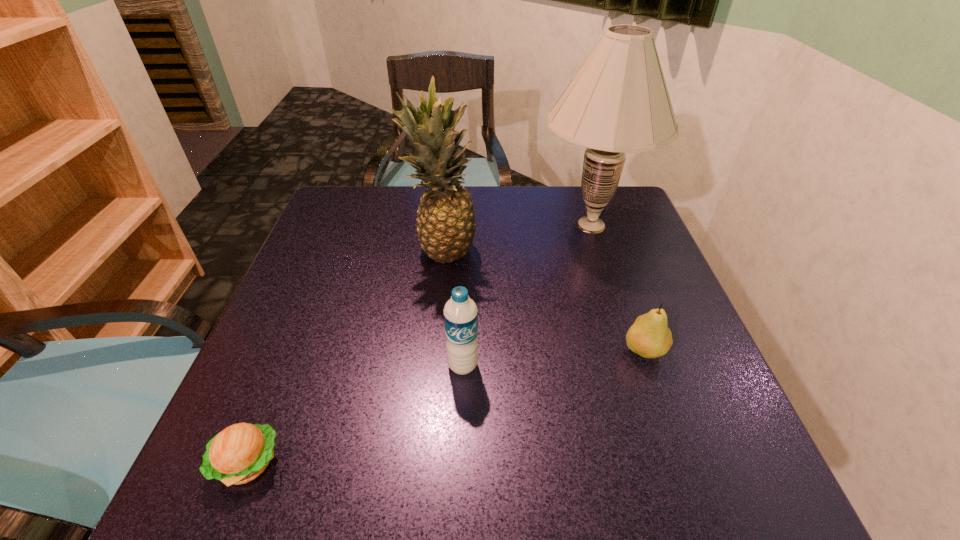
Find the location of a particular element. The width and height of the screenshot is (960, 540). vacant area between the tallest object and the second shortest object is located at coordinates (617, 288).

The width and height of the screenshot is (960, 540). In order to click on free spot between the second tallest object and the lampshade in this screenshot , I will do `click(517, 238)`.

Identify the location of free spot between the nearest object and the third tallest object. (355, 414).

Locate an element on the screen. The image size is (960, 540). vacant area that lies between the lampshade and the shortest object is located at coordinates (420, 344).

This screenshot has height=540, width=960. I want to click on free spot between the tallest object and the water bottle, so click(527, 295).

Choose which object is the fourth nearest neighbor to the nearest object. Please provide its 2D coordinates. Your answer should be formatted as a tuple, i.e. [(x, y)], where the tuple contains the x and y coordinates of a point satisfying the conditions above.

[(618, 102)]

Select which object appears as the closest to the tallest object. Please provide its 2D coordinates. Your answer should be formatted as a tuple, i.e. [(x, y)], where the tuple contains the x and y coordinates of a point satisfying the conditions above.

[(446, 225)]

Find the location of a particular element. vacant region that satisfies the following two spatial constraints: 1. on the back side of the pineapple; 2. on the left side of the lampshade is located at coordinates (445, 225).

At what (x,y) coordinates should I click in order to perform the action: click on free space that satisfies the following two spatial constraints: 1. on the back side of the fourth tallest object; 2. on the left side of the nearest object. Please return your answer as a coordinate pair (x, y). Looking at the image, I should click on (293, 350).